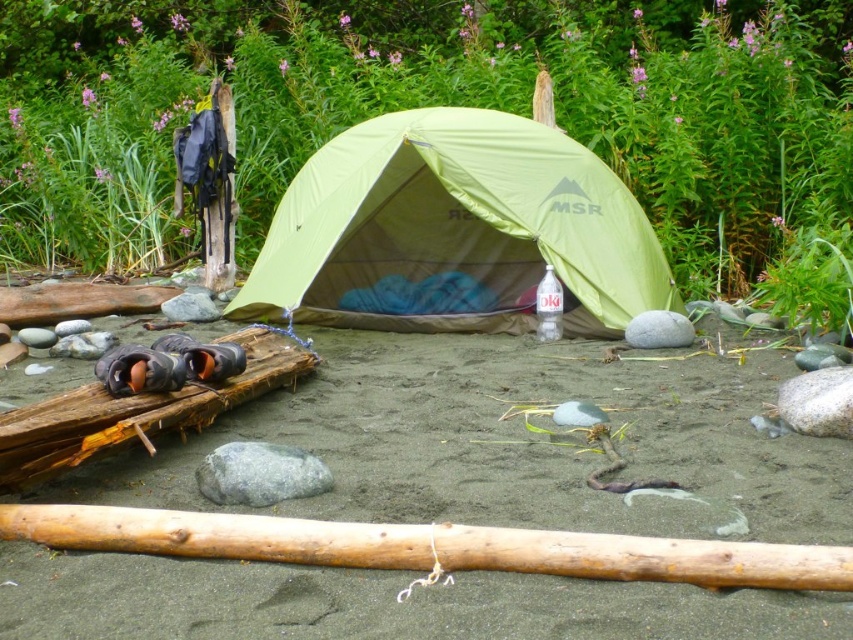
Consider the image. You are a hiker who wants to place a small backpack on the ground. The backpack is 10 cm tall. You have two options for placement on the sandy brown sand at center and gray smooth rock at center. Which surface will allow the backpack to be fully visible without being hidden by the terrain?

The gray smooth rock at center is shorter than the sandy brown sand at center. Since the backpack is 10 cm tall, placing it on the gray smooth rock at center would ensure it remains fully visible as the rock is lower, allowing the backpack to stand out against the sand.

You are a camper who wants to place a 10cm wide tent stake exactly where the smooth light brown log at center is located. Is this possible?

The smooth light brown log at center is located at point (428,547), so placing a 10cm wide tent stake there would require checking if the log is wide enough. However, the description does not provide the log width, so it is uncertain.

You are a drone operator who needs to capture a closeup of the sandy brown sand at center. According to the coordinates provided, where should you position the drone to get the best shot?

The sandy brown sand at center is located at point (514, 442), so position the drone at that coordinate for the best closeup shot.